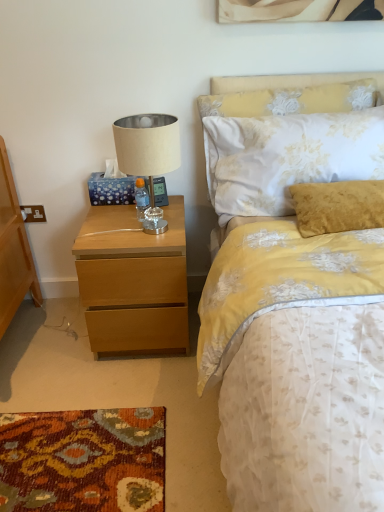
What do you see at coordinates (291, 94) in the screenshot? I see `floral fabric pillow at upper right` at bounding box center [291, 94].

Where is `beige fabric lampshade at upper left`? beige fabric lampshade at upper left is located at coordinates (148, 155).

From a real-world perspective, is floral fabric pillow at upper right positioned under light wood nightstand at left based on gravity?

Incorrect, from a real-world perspective, floral fabric pillow at upper right is higher than light wood nightstand at left.

You are a GUI agent. You are given a task and a screenshot of the screen. Output one action in this format:
    pyautogui.click(x=<x>, y=<y>)
    Task: Click on the pillow behind the light wood nightstand at left
    This screenshot has width=384, height=512.
    Given the screenshot: What is the action you would take?
    pyautogui.click(x=291, y=94)

Who is smaller, floral fabric pillow at upper right or light wood nightstand at left?

floral fabric pillow at upper right is smaller.

What's the angular difference between beige fabric lampshade at upper left and floral fabric pillow at upper right's facing directions?

There is a 0.836-degree angle between the facing directions of beige fabric lampshade at upper left and floral fabric pillow at upper right.

Is beige fabric lampshade at upper left turned away from floral fabric pillow at upper right?

beige fabric lampshade at upper left is not turned away from floral fabric pillow at upper right.

In the image, is beige fabric lampshade at upper left on the left side or the right side of floral fabric pillow at upper right?

Clearly, beige fabric lampshade at upper left is on the left of floral fabric pillow at upper right in the image.

Is beige fabric lampshade at upper left to the right of light wood nightstand at left from the viewer's perspective?

Yes.

Is beige fabric lampshade at upper left behind light wood nightstand at left?

No.

Between beige fabric lampshade at upper left and light wood nightstand at left, which one has larger size?

Bigger between the two is light wood nightstand at left.

Looking at this image, are beige fabric lampshade at upper left and light wood nightstand at left located far from each other?

beige fabric lampshade at upper left is actually quite close to light wood nightstand at left.

Which object is positioned more to the left, floral fabric pillow at upper right or beige fabric lampshade at upper left?

Positioned to the left is beige fabric lampshade at upper left.

Is floral fabric pillow at upper right positioned behind beige fabric lampshade at upper left?

Yes, floral fabric pillow at upper right is further from the viewer.

Is floral fabric pillow at upper right oriented towards beige fabric lampshade at upper left?

No, floral fabric pillow at upper right is not facing towards beige fabric lampshade at upper left.

From a real-world perspective, is floral fabric pillow at upper right above or below beige fabric lampshade at upper left?

floral fabric pillow at upper right is situated higher than beige fabric lampshade at upper left in the real world.

From a real-world perspective, is light wood nightstand at left positioned over beige fabric lampshade at upper left based on gravity?

Incorrect, from a real-world perspective, light wood nightstand at left is lower than beige fabric lampshade at upper left.

Would you consider light wood nightstand at left to be distant from beige fabric lampshade at upper left?

They are positioned close to each other.

Looking at this image, who is bigger, light wood nightstand at left or beige fabric lampshade at upper left?

light wood nightstand at left.

Between light wood nightstand at left and beige fabric lampshade at upper left, which one appears on the right side from the viewer's perspective?

beige fabric lampshade at upper left.

Based on the photo, considering the sizes of objects light wood nightstand at left and floral fabric pillow at upper right in the image provided, who is bigger, light wood nightstand at left or floral fabric pillow at upper right?

With larger size is light wood nightstand at left.

Considering the relative positions of light wood nightstand at left and floral fabric pillow at upper right in the image provided, is light wood nightstand at left to the right of floral fabric pillow at upper right from the viewer's perspective?

No.

Can you tell me how much light wood nightstand at left and floral fabric pillow at upper right differ in facing direction?

The angular difference between light wood nightstand at left and floral fabric pillow at upper right is 0.836 degrees.

You are a GUI agent. You are given a task and a screenshot of the screen. Output one action in this format:
    pyautogui.click(x=<x>, y=<y>)
    Task: Click on the pillow above the light wood nightstand at left (from a real-world perspective)
    This screenshot has width=384, height=512.
    Given the screenshot: What is the action you would take?
    coord(291,94)

Identify the location of pillow on the right of the beige fabric lampshade at upper left. (291, 94).

Considering their positions, is light wood nightstand at left positioned further to floral fabric pillow at upper right than beige fabric lampshade at upper left?

light wood nightstand at left.

Looking at the image, which one is located closer to light wood nightstand at left, beige fabric lampshade at upper left or floral fabric pillow at upper right?

beige fabric lampshade at upper left.

From the image, which object appears to be farther from beige fabric lampshade at upper left, floral fabric pillow at upper right or light wood nightstand at left?

floral fabric pillow at upper right.

From the image, which object appears to be nearer to floral fabric pillow at upper right, beige fabric lampshade at upper left or light wood nightstand at left?

beige fabric lampshade at upper left is positioned closer to the anchor floral fabric pillow at upper right.

Which object lies further to the anchor point light wood nightstand at left, floral fabric pillow at upper right or beige fabric lampshade at upper left?

floral fabric pillow at upper right is further to light wood nightstand at left.

When comparing their distances from beige fabric lampshade at upper left, does light wood nightstand at left or floral fabric pillow at upper right seem further?

Based on the image, floral fabric pillow at upper right appears to be further to beige fabric lampshade at upper left.

Find the location of a particular element. The image size is (384, 512). table lamp between light wood nightstand at left and floral fabric pillow at upper right from left to right is located at coordinates (148, 155).